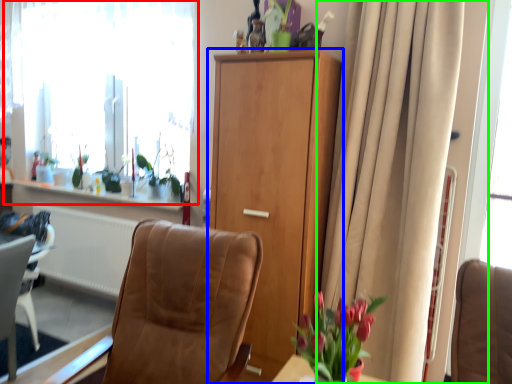
Question: Which is farther away from window (highlighted by a red box)? cabinetry (highlighted by a blue box) or curtain (highlighted by a green box)?

Choices:
 (A) cabinetry
 (B) curtain

Answer: (B)